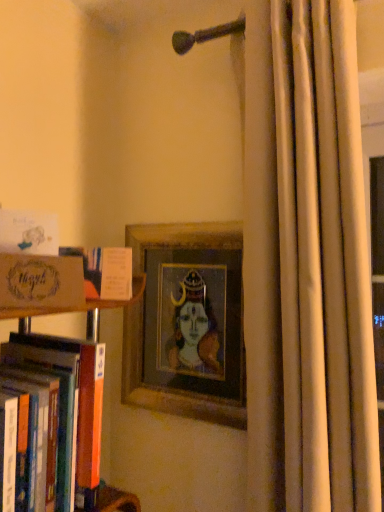
Image resolution: width=384 pixels, height=512 pixels. What do you see at coordinates (187, 322) in the screenshot?
I see `wooden picture frame at center` at bounding box center [187, 322].

I want to click on wooden picture frame at center, so click(x=187, y=322).

Which is more to the left, wooden picture frame at center or beige fabric curtain at right?

wooden picture frame at center is more to the left.

Are wooden picture frame at center and beige fabric curtain at right far apart?

Actually, wooden picture frame at center and beige fabric curtain at right are a little close together.

Is wooden picture frame at center not inside beige fabric curtain at right?

Yes.

Could you tell me if wooden picture frame at center is facing beige fabric curtain at right?

No, wooden picture frame at center is not aimed at beige fabric curtain at right.

From a real-world perspective, is matte cardboard box at left positioned above or below orange hardcover book at left, placed as the first book when sorted from bottom to top?

matte cardboard box at left is above orange hardcover book at left, placed as the first book when sorted from bottom to top.

Could you measure the distance between matte cardboard box at left and orange hardcover book at left, placed as the first book when sorted from bottom to top?

They are 8.28 inches apart.

Which is nearer, [14,260] or [91,492]?

Point [14,260] appears to be closer to the viewer than point [91,492].

Considering the positions of objects matte cardboard box at left and orange hardcover book at left, placed as the first book when sorted from bottom to top, in the image provided, who is more to the right, matte cardboard box at left or orange hardcover book at left, placed as the first book when sorted from bottom to top,?

From the viewer's perspective, matte cardboard box at left appears more on the right side.

Is beige fabric curtain at right turned away from matte cardboard box at left?

beige fabric curtain at right does not have its back to matte cardboard box at left.

Where is `curtain behind the matte cardboard box at left`? Image resolution: width=384 pixels, height=512 pixels. curtain behind the matte cardboard box at left is located at coordinates (324, 262).

From the image's perspective, is beige fabric curtain at right above or below matte cardboard box at left?

beige fabric curtain at right is situated higher than matte cardboard box at left in the image.

Is beige fabric curtain at right to the right of matte cardboard box at left from the viewer's perspective?

Yes.

Which is more to the right, beige fabric curtain at right or wooden picture frame at center?

beige fabric curtain at right.

How distant is beige fabric curtain at right from wooden picture frame at center?

beige fabric curtain at right and wooden picture frame at center are 14.40 inches apart.

What's the angular difference between beige fabric curtain at right and wooden picture frame at center's facing directions?

The angular difference between beige fabric curtain at right and wooden picture frame at center is 1.31 degrees.

Which object is further away from the camera, beige fabric curtain at right or wooden picture frame at center?

wooden picture frame at center is further from the camera.

Between matte cardboard box at left and orange cardboard book at left, acting as the second book starting from the bottom, which one has smaller width?

orange cardboard book at left, acting as the second book starting from the bottom, is thinner.

The height and width of the screenshot is (512, 384). What are the coordinates of `book that is the 2nd one when counting backward from the matte cardboard box at left` in the screenshot? It's located at (105, 271).

Is matte cardboard box at left facing away from orange cardboard book at left, which ranks as the second book in top-to-bottom order?

matte cardboard box at left does not have its back to orange cardboard book at left, which ranks as the second book in top-to-bottom order.

From the image's perspective, which is above, matte cardboard box at left or orange cardboard book at left, which ranks as the second book in top-to-bottom order?

From the image's view, orange cardboard book at left, which ranks as the second book in top-to-bottom order, is above.

Is beige fabric curtain at right positioned with its back to orange hardcover book at left, placed as the first book when sorted from bottom to top?

No, beige fabric curtain at right is not facing the opposite direction of orange hardcover book at left, placed as the first book when sorted from bottom to top.

Which is correct: beige fabric curtain at right is inside orange hardcover book at left, the 3th book when ordered from top to bottom, or outside of it?

beige fabric curtain at right is located beyond the bounds of orange hardcover book at left, the 3th book when ordered from top to bottom.

Is point (318, 254) farther from viewer compared to point (100, 387)?

Yes, it is.

Which of these two, orange hardcover book at left, the 3th book when ordered from top to bottom, or orange cardboard book at left, acting as the second book starting from the bottom, is wider?

With larger width is orange hardcover book at left, the 3th book when ordered from top to bottom.

Considering the sizes of orange hardcover book at left, the 3th book when ordered from top to bottom, and orange cardboard book at left, which ranks as the second book in top-to-bottom order, in the image, is orange hardcover book at left, the 3th book when ordered from top to bottom, taller or shorter than orange cardboard book at left, which ranks as the second book in top-to-bottom order,?

Considering their sizes, orange hardcover book at left, the 3th book when ordered from top to bottom, has more height than orange cardboard book at left, which ranks as the second book in top-to-bottom order.

Is orange hardcover book at left, placed as the first book when sorted from bottom to top, further to camera compared to orange cardboard book at left, acting as the second book starting from the bottom?

No, orange hardcover book at left, placed as the first book when sorted from bottom to top, is in front of orange cardboard book at left, acting as the second book starting from the bottom.

Is orange hardcover book at left, the 3th book when ordered from top to bottom, beside orange cardboard book at left, acting as the second book starting from the bottom?

No, orange hardcover book at left, the 3th book when ordered from top to bottom, is not in contact with orange cardboard book at left, acting as the second book starting from the bottom.

Image resolution: width=384 pixels, height=512 pixels. I want to click on curtain in front of the wooden picture frame at center, so click(324, 262).

Find the location of `paperback book that is behind the orange hardcover book at left, the 3th book when ordered from top to bottom`. paperback book that is behind the orange hardcover book at left, the 3th book when ordered from top to bottom is located at coordinates (x=41, y=282).

Looking at the image, which one is located further to wooden picture frame at center, orange hardcover book at left, placed as the first book when sorted from bottom to top, or matte paper card at left, the 1th book when ordered from top to bottom?

matte paper card at left, the 1th book when ordered from top to bottom, is further to wooden picture frame at center.

When comparing their distances from matte paper card at left, the 1th book when ordered from top to bottom, does orange hardcover book at left, the 3th book when ordered from top to bottom, or orange cardboard book at left, acting as the second book starting from the bottom, seem further?

The object further to matte paper card at left, the 1th book when ordered from top to bottom, is orange hardcover book at left, the 3th book when ordered from top to bottom.

Which object lies nearer to the anchor point orange hardcover book at left, placed as the first book when sorted from bottom to top, wooden picture frame at center or beige fabric curtain at right?

wooden picture frame at center.

Considering their positions, is matte paper card at left, the 1th book when ordered from top to bottom, positioned closer to matte cardboard box at left than beige fabric curtain at right?

matte paper card at left, the 1th book when ordered from top to bottom, is closer to matte cardboard box at left.

Estimate the real-world distances between objects in this image. Which object is closer to beige fabric curtain at right, matte paper card at left, marked as the third book in a bottom-to-top arrangement, or orange hardcover book at left, placed as the first book when sorted from bottom to top?

Among the two, orange hardcover book at left, placed as the first book when sorted from bottom to top, is located nearer to beige fabric curtain at right.

When comparing their distances from orange hardcover book at left, placed as the first book when sorted from bottom to top, does orange cardboard book at left, acting as the second book starting from the bottom, or beige fabric curtain at right seem further?

beige fabric curtain at right lies further to orange hardcover book at left, placed as the first book when sorted from bottom to top, than the other object.

Considering their positions, is matte cardboard box at left positioned closer to orange hardcover book at left, the 3th book when ordered from top to bottom, than beige fabric curtain at right?

matte cardboard box at left is positioned closer to the anchor orange hardcover book at left, the 3th book when ordered from top to bottom.

Estimate the real-world distances between objects in this image. Which object is further from matte paper card at left, marked as the third book in a bottom-to-top arrangement, wooden picture frame at center or orange cardboard book at left, which ranks as the second book in top-to-bottom order?

wooden picture frame at center is positioned further to the anchor matte paper card at left, marked as the third book in a bottom-to-top arrangement.

Image resolution: width=384 pixels, height=512 pixels. I want to click on book that lies between matte paper card at left, marked as the third book in a bottom-to-top arrangement, and orange hardcover book at left, placed as the first book when sorted from bottom to top, from top to bottom, so click(105, 271).

I want to click on paperback book between matte paper card at left, the 1th book when ordered from top to bottom, and beige fabric curtain at right from left to right, so click(x=41, y=282).

Image resolution: width=384 pixels, height=512 pixels. What are the coordinates of `paperback book between orange cardboard book at left, acting as the second book starting from the bottom, and orange hardcover book at left, the 3th book when ordered from top to bottom, vertically` in the screenshot? It's located at (41, 282).

Where is `book positioned between matte cardboard box at left and orange cardboard book at left, acting as the second book starting from the bottom, from near to far`? Image resolution: width=384 pixels, height=512 pixels. book positioned between matte cardboard box at left and orange cardboard book at left, acting as the second book starting from the bottom, from near to far is located at coordinates (28, 232).